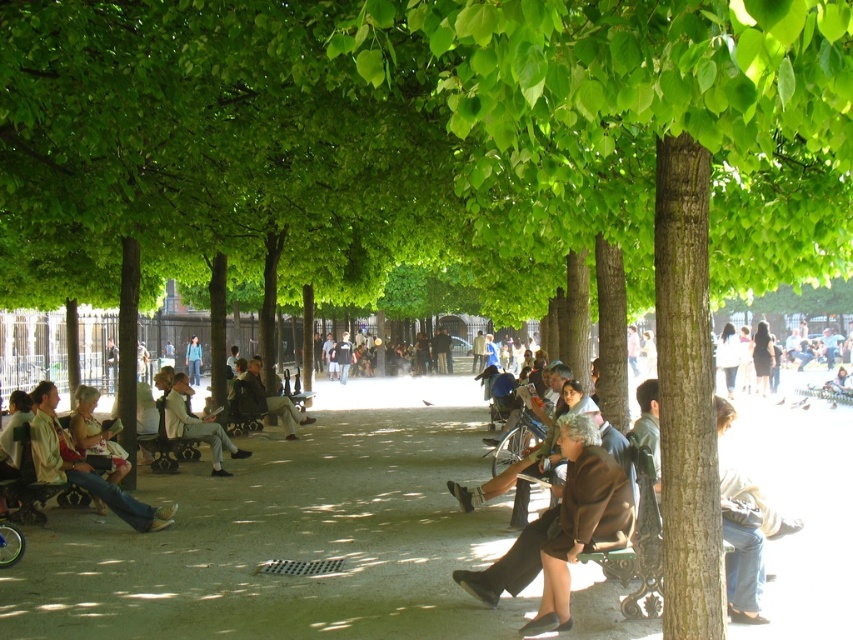
You are standing at the entrance of the park and see a light brown leather jacket at center and blue jeans at center. If you want to reach both items, which one should you head towards first to minimize the distance traveled?

The light brown leather jacket at center is 16.52 meters away from blue jeans at center, so you should head towards whichever is closer to your current position. However, since both are at the center, their distance from the entrance isn

You are a photographer standing at the park entrance and want to capture a photo of the light brown leather jacket at center and the blue jeans at center. Based on their positions, which one should you focus on first if you want to ensure both are in the frame without moving the camera?

The light brown leather jacket at center is located below the blue jeans at center, so you should focus on the blue jeans at center first to ensure both are in the frame without moving the camera.

You are standing at the entrance of the park and see two points in the scene, point [141,506] and point [83,413]. Which point is closer to you?

Point [141,506] is closer to the viewer than point [83,413].